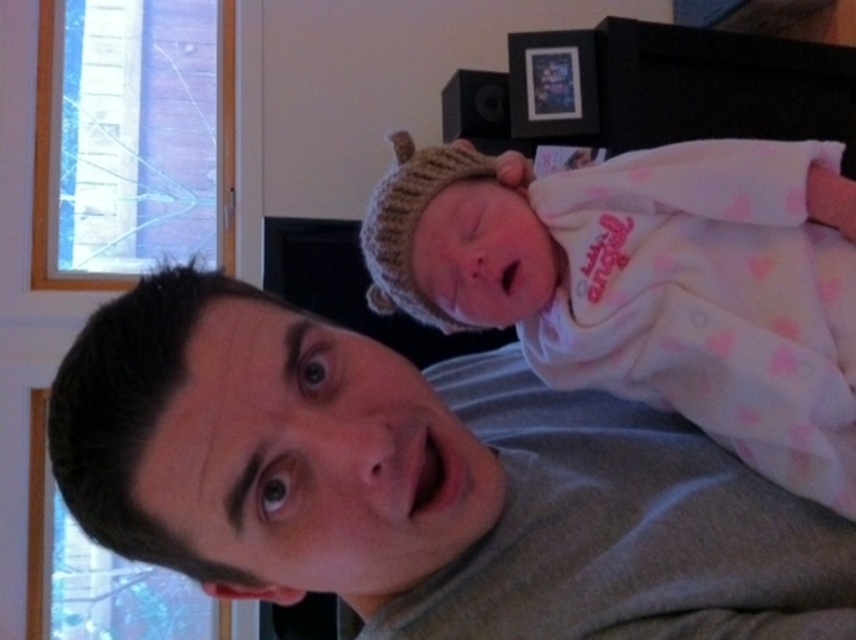
Is gray cotton shirt at upper center taller than white knit hat at upper center?

No, gray cotton shirt at upper center is not taller than white knit hat at upper center.

You are a GUI agent. You are given a task and a screenshot of the screen. Output one action in this format:
    pyautogui.click(x=<x>, y=<y>)
    Task: Click on the gray cotton shirt at upper center
    The width and height of the screenshot is (856, 640).
    Given the screenshot: What is the action you would take?
    pyautogui.click(x=419, y=483)